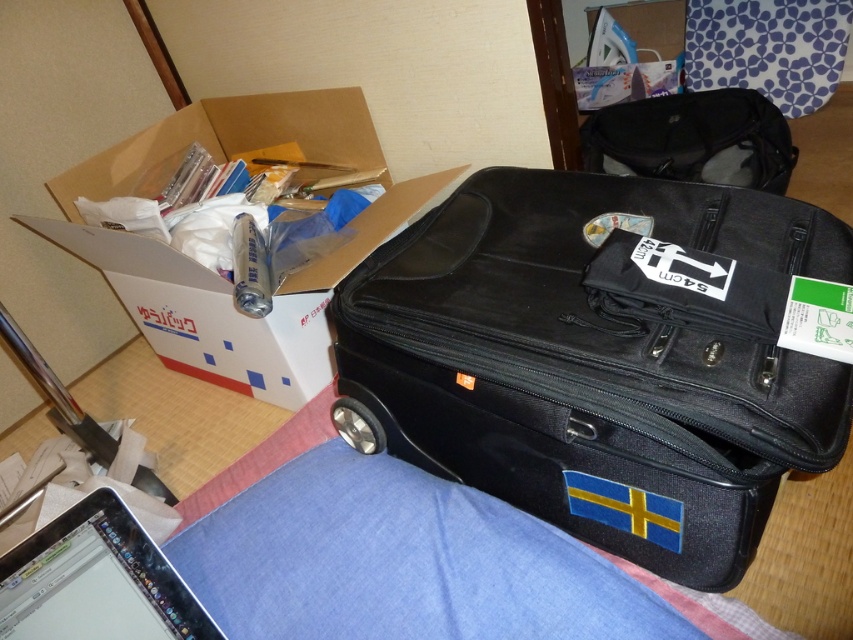
You are packing for a trip and need to place your sleek silver laptop at lower left into a storage container. Based on its current position coordinates, can you determine if it will fit into a rectangular container that measures 10cm x 15cm x 5cm?

The sleek silver laptop at lower left is positioned at coordinates point (96, 580), but without knowing the dimensions of the laptop itself, it is impossible to determine if it will fit into the container. The coordinates only indicate location, not size.

You are packing for a trip and need to place the black fabric suitcase at center and the white cardboard box at upper left into a storage closet. The closet has a width of 15 inches. Can both items fit side by side horizontally without overlapping?

The black fabric suitcase at center is 15.01 inches from the white cardboard box at upper left, meaning there is only a tiny 0.01 inch gap between them. Since the total required space would be slightly over 15 inches, they cannot fit side by side within the 15 inch width of the closet.